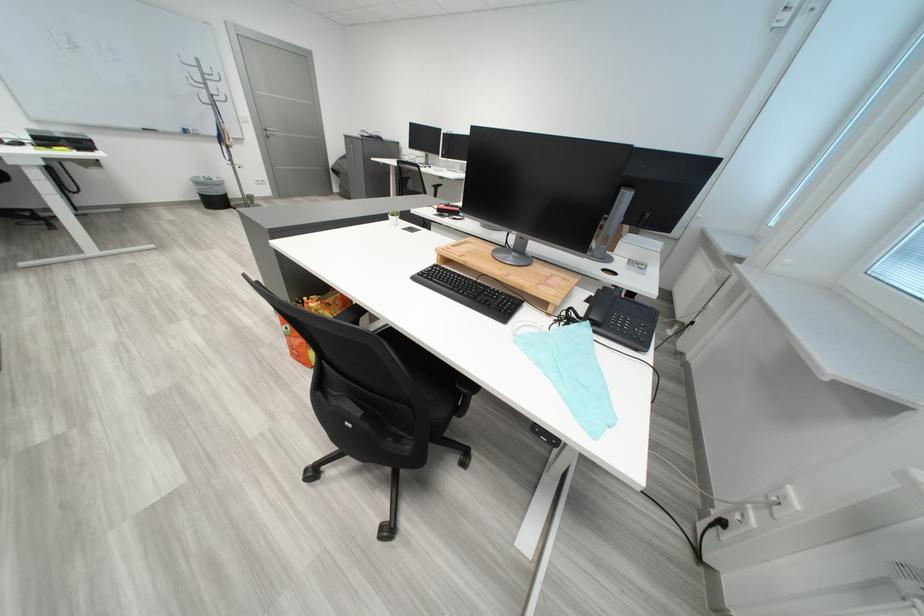
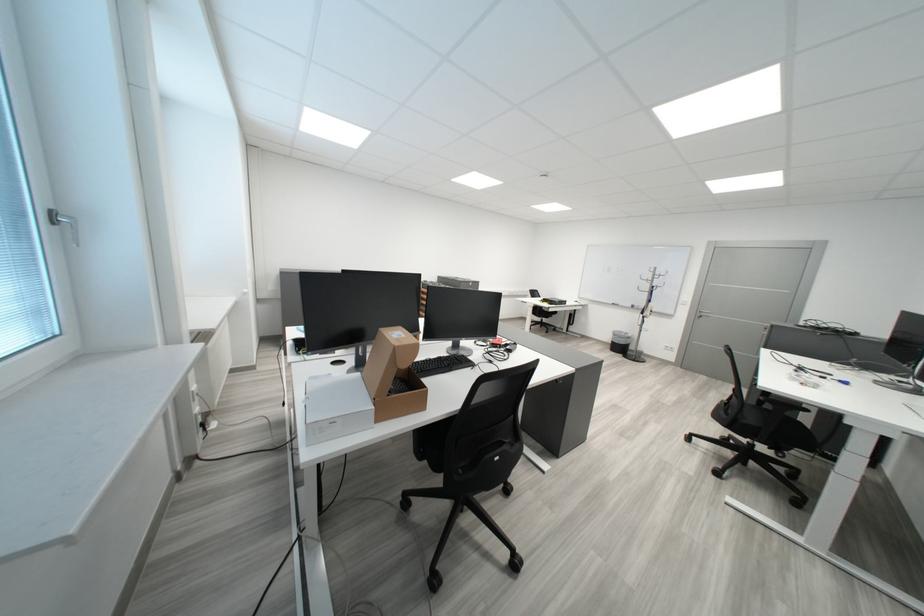
Where in the second image is the point corresponding to (219,86) from the first image?

(665, 283)